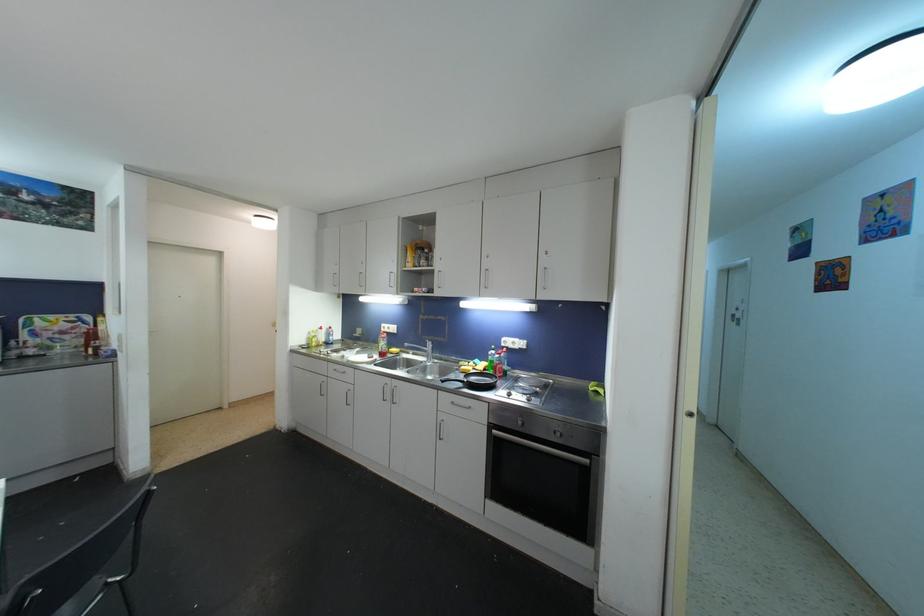
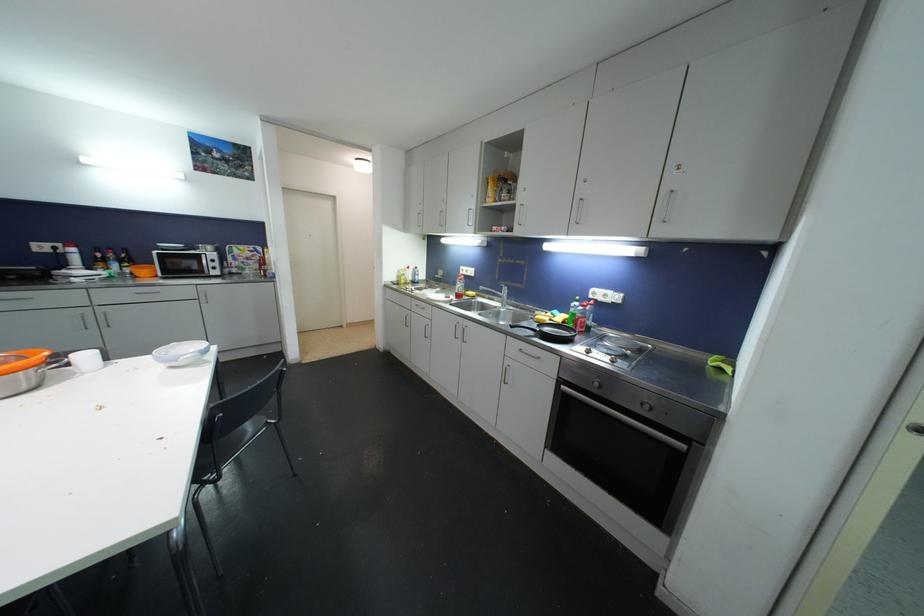
Where in the second image is the point corresponding to pixel 391 399 from the first image?

(463, 338)